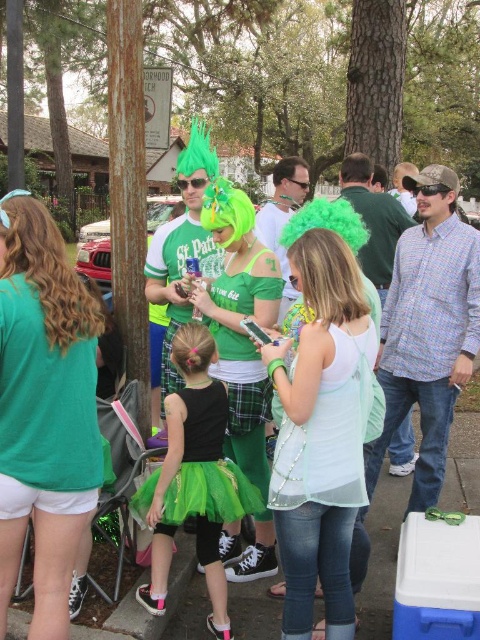
What are the coordinates of the light green mesh tank top at center?

The light green mesh tank top at center is located at coordinates point (323, 432).

You are at a St. Patrick Day party and see two people wearing green outfits. One is wearing a light green mesh tank top at center and the other is wearing a mint sheer dress at center. Which person is positioned to the left?

The light green mesh tank top at center is to the left of mint sheer dress at center, so the person wearing the light green mesh tank top at center is positioned to the left.